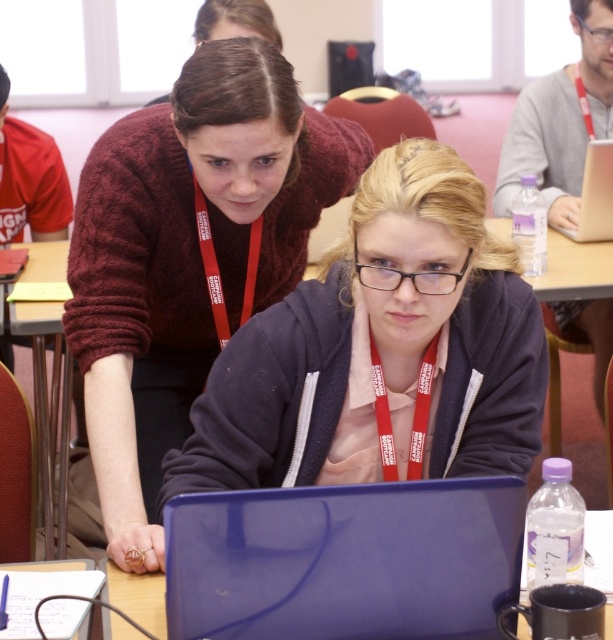
Is glossy plastic laptop at center further to camera compared to metallic silver laptop at upper right?

No, glossy plastic laptop at center is closer to the viewer.

Is glossy plastic laptop at center positioned before metallic silver laptop at upper right?

Yes, glossy plastic laptop at center is in front of metallic silver laptop at upper right.

This screenshot has width=613, height=640. Identify the location of glossy plastic laptop at center. (345, 561).

Based on the photo, is maroon knitted sweater at upper center to the left of metallic silver laptop at upper right from the viewer's perspective?

Indeed, maroon knitted sweater at upper center is positioned on the left side of metallic silver laptop at upper right.

Who is positioned more to the left, maroon knitted sweater at upper center or metallic silver laptop at upper right?

Positioned to the left is maroon knitted sweater at upper center.

Is point (129, 413) positioned after point (603, 150)?

No.

Image resolution: width=613 pixels, height=640 pixels. I want to click on maroon knitted sweater at upper center, so click(188, 256).

Image resolution: width=613 pixels, height=640 pixels. Describe the element at coordinates (188, 256) in the screenshot. I see `maroon knitted sweater at upper center` at that location.

You are a GUI agent. You are given a task and a screenshot of the screen. Output one action in this format:
    pyautogui.click(x=<x>, y=<y>)
    Task: Click on the maroon knitted sweater at upper center
    
    Given the screenshot: What is the action you would take?
    pyautogui.click(x=188, y=256)